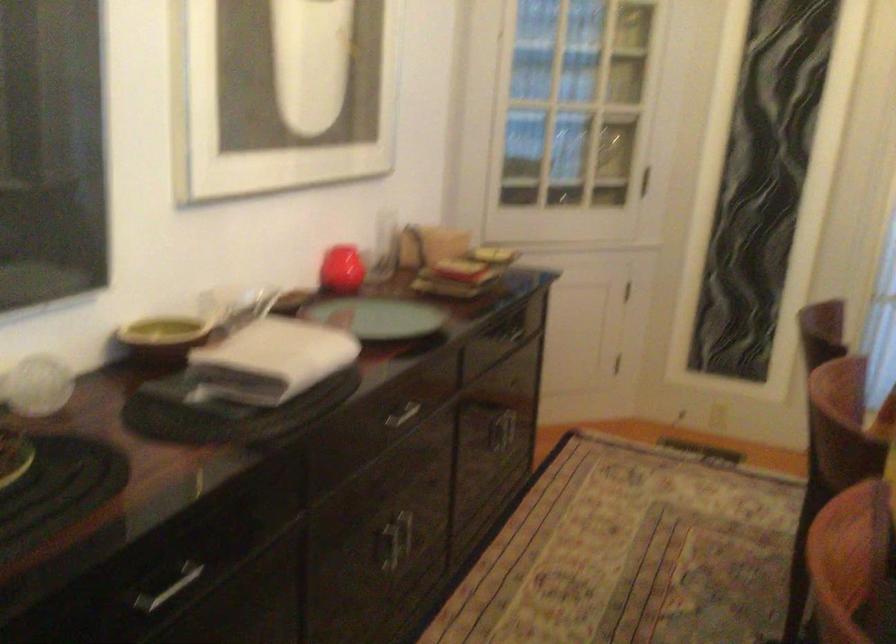
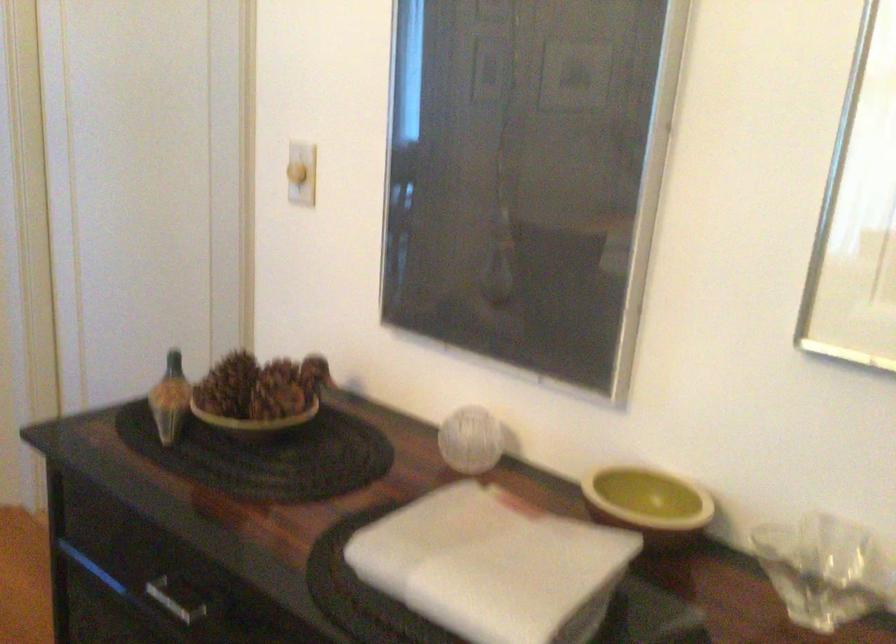
Where in the second image is the point corresponding to (x=168, y=366) from the first image?

(648, 503)